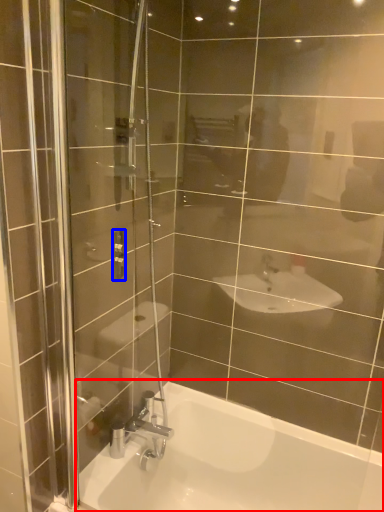
Question: Which object is closer to the camera taking this photo, bathtub (highlighted by a red box) or shower (highlighted by a blue box)?

Choices:
 (A) bathtub
 (B) shower

Answer: (A)